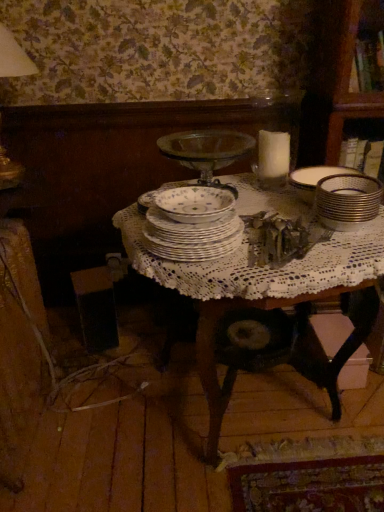
In order to click on vacant space in front of gold metallic stack at right in this screenshot , I will do (x=353, y=253).